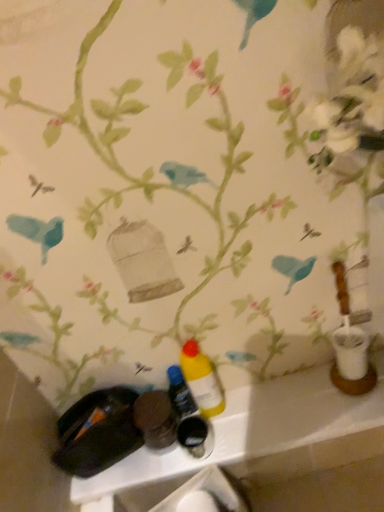
Identify the location of matte plastic bottles at lower center. This screenshot has height=512, width=384. (262, 437).

Is matte plastic bottles at lower center turned away from yellow matte bottle at center, marked as the second bottle in a right-to-left arrangement?

No, yellow matte bottle at center, marked as the second bottle in a right-to-left arrangement, is not at the back of matte plastic bottles at lower center.

Where is `counter in front of the yellow matte bottle at center, marked as the second bottle in a right-to-left arrangement`? Image resolution: width=384 pixels, height=512 pixels. counter in front of the yellow matte bottle at center, marked as the second bottle in a right-to-left arrangement is located at coordinates (262, 437).

Considering the sizes of matte plastic bottles at lower center and yellow matte bottle at center, marked as the second bottle in a right-to-left arrangement, in the image, is matte plastic bottles at lower center taller or shorter than yellow matte bottle at center, marked as the second bottle in a right-to-left arrangement,?

matte plastic bottles at lower center is shorter than yellow matte bottle at center, marked as the second bottle in a right-to-left arrangement.

Is matte plastic bottles at lower center placed right next to yellow matte bottle at center, marked as the second bottle in a right-to-left arrangement?

No, matte plastic bottles at lower center is not touching yellow matte bottle at center, marked as the second bottle in a right-to-left arrangement.

Is yellow matte bottle at center, which ranks as the 1th bottle in right-to-left order, to the right of yellow matte bottle at center, marked as the second bottle in a right-to-left arrangement, from the viewer's perspective?

Yes, yellow matte bottle at center, which ranks as the 1th bottle in right-to-left order, is to the right of yellow matte bottle at center, marked as the second bottle in a right-to-left arrangement.

How much distance is there between yellow matte bottle at center, which ranks as the 1th bottle in right-to-left order, and yellow matte bottle at center, which is counted as the 1th bottle, starting from the left?

yellow matte bottle at center, which ranks as the 1th bottle in right-to-left order, is 5.57 centimeters from yellow matte bottle at center, which is counted as the 1th bottle, starting from the left.

Based on the photo, would you say yellow matte bottle at center, which is counted as the 2th bottle, starting from the left, contains yellow matte bottle at center, which is counted as the 1th bottle, starting from the left?

No, yellow matte bottle at center, which is counted as the 1th bottle, starting from the left, is not a part of yellow matte bottle at center, which is counted as the 2th bottle, starting from the left.

Which of these two, yellow matte bottle at center, which is counted as the 2th bottle, starting from the left, or yellow matte bottle at center, marked as the second bottle in a right-to-left arrangement, is smaller?

With smaller size is yellow matte bottle at center, marked as the second bottle in a right-to-left arrangement.

What's the angular difference between yellow matte bottle at center, marked as the second bottle in a right-to-left arrangement, and yellow matte bottle at center, which ranks as the 1th bottle in right-to-left order,'s facing directions?

0.00063 degrees.

From the image's perspective, which one is positioned lower, yellow matte bottle at center, which is counted as the 1th bottle, starting from the left, or yellow matte bottle at center, which is counted as the 2th bottle, starting from the left?

yellow matte bottle at center, which is counted as the 1th bottle, starting from the left.

Looking at this image, from a real-world perspective, which is physically below, yellow matte bottle at center, which is counted as the 1th bottle, starting from the left, or yellow matte bottle at center, which is counted as the 2th bottle, starting from the left?

yellow matte bottle at center, which is counted as the 1th bottle, starting from the left, is physically lower.

Which object is further away from the camera, yellow matte bottle at center, marked as the second bottle in a right-to-left arrangement, or yellow matte bottle at center, which is counted as the 2th bottle, starting from the left?

yellow matte bottle at center, marked as the second bottle in a right-to-left arrangement, is further away from the camera.

From the picture: Considering the relative sizes of matte plastic bottles at lower center and yellow matte bottle at center, which is counted as the 2th bottle, starting from the left, in the image provided, is matte plastic bottles at lower center taller than yellow matte bottle at center, which is counted as the 2th bottle, starting from the left,?

No.

Is matte plastic bottles at lower center in contact with yellow matte bottle at center, which ranks as the 1th bottle in right-to-left order?

matte plastic bottles at lower center and yellow matte bottle at center, which ranks as the 1th bottle in right-to-left order, are not in contact.

What's the angular difference between matte plastic bottles at lower center and yellow matte bottle at center, which is counted as the 2th bottle, starting from the left,'s facing directions?

There is a 0.597-degree angle between the facing directions of matte plastic bottles at lower center and yellow matte bottle at center, which is counted as the 2th bottle, starting from the left.

Where is `counter directly beneath the yellow matte bottle at center, marked as the second bottle in a right-to-left arrangement (from a real-world perspective)`? counter directly beneath the yellow matte bottle at center, marked as the second bottle in a right-to-left arrangement (from a real-world perspective) is located at coordinates (262, 437).

Would you say yellow matte bottle at center, marked as the second bottle in a right-to-left arrangement, is outside matte plastic bottles at lower center?

yellow matte bottle at center, marked as the second bottle in a right-to-left arrangement, is positioned outside matte plastic bottles at lower center.

Which is in front, point (177, 405) or point (300, 376)?

The point (300, 376) is closer to the camera.

Looking at this image, in the image, is yellow matte bottle at center, which is counted as the 1th bottle, starting from the left, on the left side or the right side of matte plastic bottles at lower center?

Clearly, yellow matte bottle at center, which is counted as the 1th bottle, starting from the left, is on the left of matte plastic bottles at lower center in the image.

Considering the sizes of yellow matte bottle at center, which ranks as the 1th bottle in right-to-left order, and matte plastic bottles at lower center in the image, is yellow matte bottle at center, which ranks as the 1th bottle in right-to-left order, taller or shorter than matte plastic bottles at lower center?

Considering their sizes, yellow matte bottle at center, which ranks as the 1th bottle in right-to-left order, has more height than matte plastic bottles at lower center.

Is yellow matte bottle at center, which is counted as the 2th bottle, starting from the left, to the right of matte plastic bottles at lower center from the viewer's perspective?

Incorrect, yellow matte bottle at center, which is counted as the 2th bottle, starting from the left, is not on the right side of matte plastic bottles at lower center.

Is yellow matte bottle at center, which is counted as the 2th bottle, starting from the left, touching matte plastic bottles at lower center?

yellow matte bottle at center, which is counted as the 2th bottle, starting from the left, is not next to matte plastic bottles at lower center, and they're not touching.

Which object is further away from the camera taking this photo, yellow matte bottle at center, which is counted as the 2th bottle, starting from the left, or matte plastic bottles at lower center?

matte plastic bottles at lower center is behind.

From the image's perspective, count 1st bottles upward from the matte plastic bottles at lower center and point to it. Please provide its 2D coordinates.

[(180, 393)]

The image size is (384, 512). Identify the location of bottle on the left of yellow matte bottle at center, which ranks as the 1th bottle in right-to-left order. [180, 393].

Based on their spatial positions, is yellow matte bottle at center, which ranks as the 1th bottle in right-to-left order, or matte plastic bottles at lower center further from yellow matte bottle at center, marked as the second bottle in a right-to-left arrangement?

The object further to yellow matte bottle at center, marked as the second bottle in a right-to-left arrangement, is matte plastic bottles at lower center.

Looking at the image, which one is located further to matte plastic bottles at lower center, yellow matte bottle at center, which is counted as the 2th bottle, starting from the left, or yellow matte bottle at center, marked as the second bottle in a right-to-left arrangement?

The object further to matte plastic bottles at lower center is yellow matte bottle at center, marked as the second bottle in a right-to-left arrangement.

Looking at this image, from the image, which object appears to be farther from yellow matte bottle at center, marked as the second bottle in a right-to-left arrangement, matte plastic bottles at lower center or yellow matte bottle at center, which is counted as the 2th bottle, starting from the left?

matte plastic bottles at lower center.

Considering their positions, is yellow matte bottle at center, which is counted as the 1th bottle, starting from the left, positioned closer to matte plastic bottles at lower center than yellow matte bottle at center, which is counted as the 2th bottle, starting from the left?

Among the two, yellow matte bottle at center, which is counted as the 2th bottle, starting from the left, is located nearer to matte plastic bottles at lower center.

Based on their spatial positions, is yellow matte bottle at center, which is counted as the 1th bottle, starting from the left, or matte plastic bottles at lower center closer to yellow matte bottle at center, which is counted as the 2th bottle, starting from the left?

yellow matte bottle at center, which is counted as the 1th bottle, starting from the left, is positioned closer to the anchor yellow matte bottle at center, which is counted as the 2th bottle, starting from the left.

Based on their spatial positions, is matte plastic bottles at lower center or yellow matte bottle at center, marked as the second bottle in a right-to-left arrangement, closer to yellow matte bottle at center, which is counted as the 2th bottle, starting from the left?

The object closer to yellow matte bottle at center, which is counted as the 2th bottle, starting from the left, is yellow matte bottle at center, marked as the second bottle in a right-to-left arrangement.

At what (x,y) coordinates should I click in order to perform the action: click on bottle between yellow matte bottle at center, which is counted as the 1th bottle, starting from the left, and matte plastic bottles at lower center from left to right. Please return your answer as a coordinate pair (x, y). The width and height of the screenshot is (384, 512). Looking at the image, I should click on (202, 380).